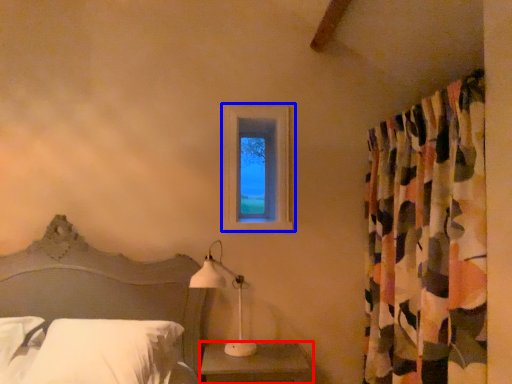
Question: Which object is closer to the camera taking this photo, nightstand (highlighted by a red box) or window (highlighted by a blue box)?

Choices:
 (A) nightstand
 (B) window

Answer: (A)